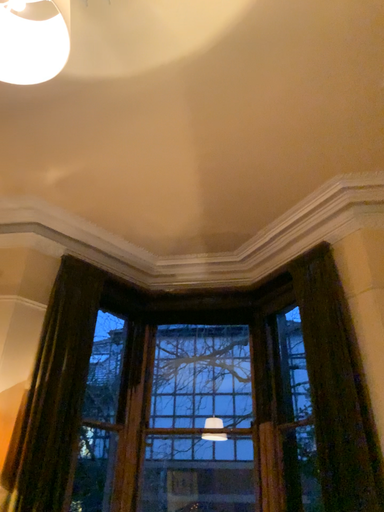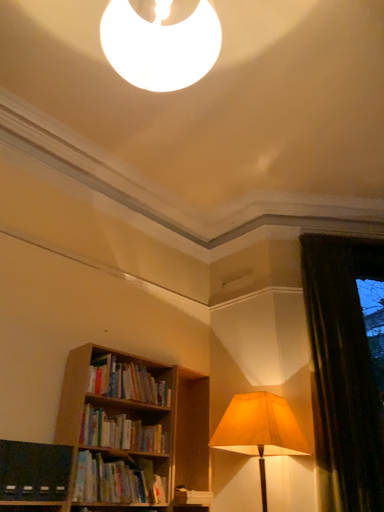
Question: Which way did the camera rotate in the video?

Choices:
 (A) rotated upward
 (B) rotated downward

Answer: (B)